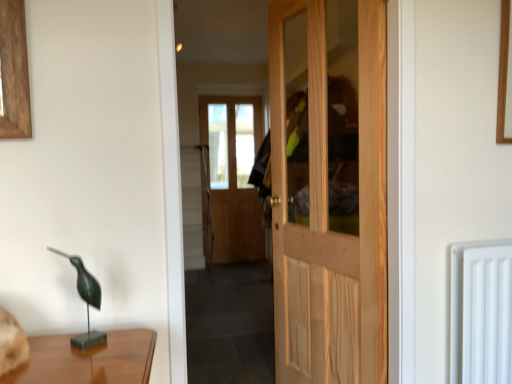
Question: Considering the positions of white plastic radiator at right and natural wood door at center in the image, is white plastic radiator at right bigger or smaller than natural wood door at center?

Choices:
 (A) big
 (B) small

Answer: (B)

Question: In the image, is white plastic radiator at right positioned in front of or behind natural wood door at center?

Choices:
 (A) behind
 (B) front

Answer: (B)

Question: Estimate the real-world distances between objects in this image. Which object is closer to the natural wood door at center?

Choices:
 (A) white plastic radiator at right
 (B) green patina metal bird at left

Answer: (A)

Question: Estimate the real-world distances between objects in this image. Which object is farther from the natural wood door at center?

Choices:
 (A) white plastic radiator at right
 (B) green patina metal bird at left

Answer: (B)